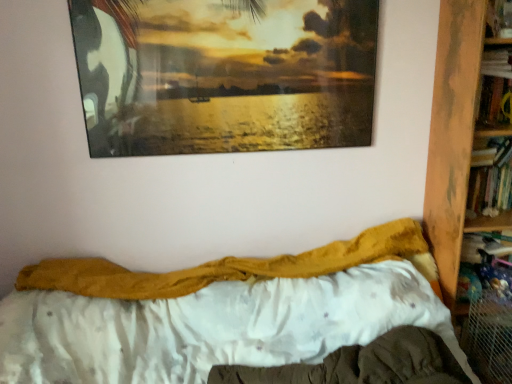
Identify the location of free spot below metallic glossy picture frame at upper center (from a real-world perspective). (225, 225).